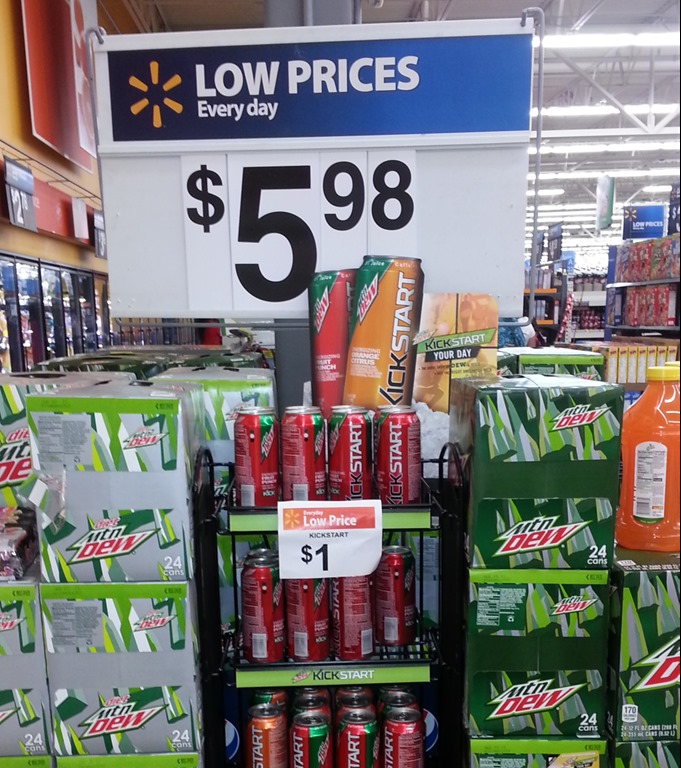
Find the location of `metal ceiling at top left`. metal ceiling at top left is located at coordinates (667, 107).